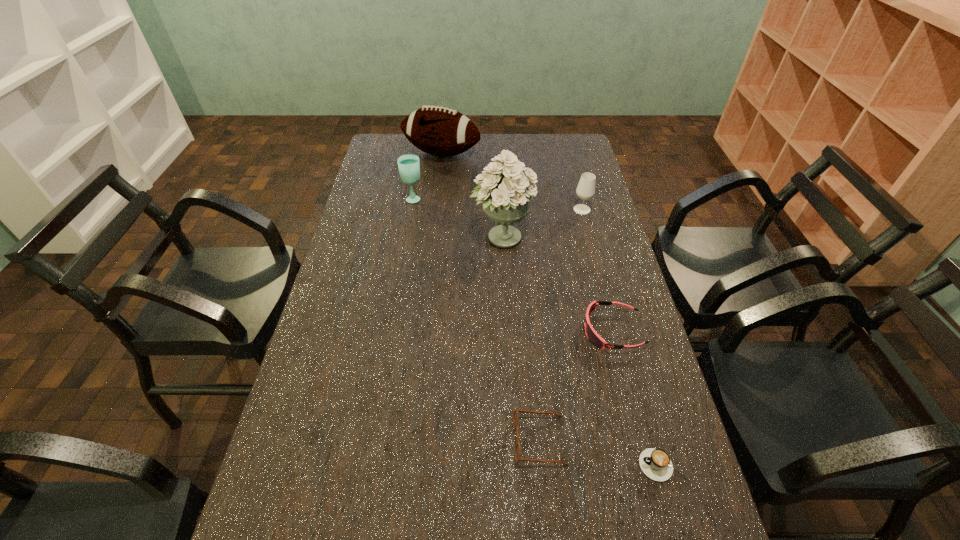
Locate an element on the screen. free space between the third shortest object and the tallest object is located at coordinates (557, 284).

The image size is (960, 540). In order to click on vacant space that's between the sixth shortest object and the spectacles in this screenshot , I will do `click(491, 297)`.

The width and height of the screenshot is (960, 540). I want to click on the second closest object to the cappuccino, so click(592, 335).

In order to click on object that is the fourth closest to the cappuccino in this screenshot , I will do `click(585, 190)`.